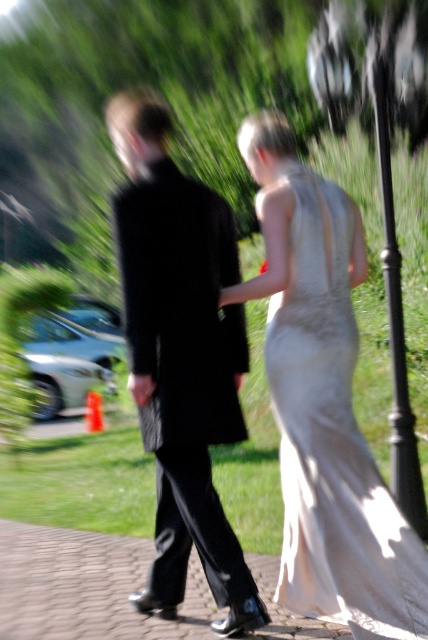
You are a photographer who needs to adjust the lighting for the couple in the image. Since the black velvet suit at center and ivory satin dress at center are positioned in the scene, which one is closer to the lamppost on the right side of the frame?

The ivory satin dress at center is closer to the lamppost on the right side of the frame because the black velvet suit at center is to the left of it, meaning the ivory satin dress is positioned to the right side of the black velvet suit at center.

You are a photographer who wants to capture the ivory satin dress at center in focus while keeping the background blurred. Given that the point at coordinates point (332,440) is the center of the dress, where should you focus your camera?

The point at coordinates point (332,440) corresponds to the ivory satin dress at center, so you should focus your camera on that point to keep the dress in focus while maintaining the background blur.